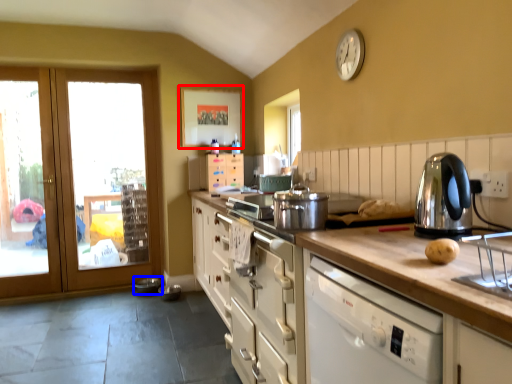
Question: Which point is closer to the camera, picture frame (highlighted by a red box) or appliance (highlighted by a blue box)?

Choices:
 (A) picture frame
 (B) appliance

Answer: (B)